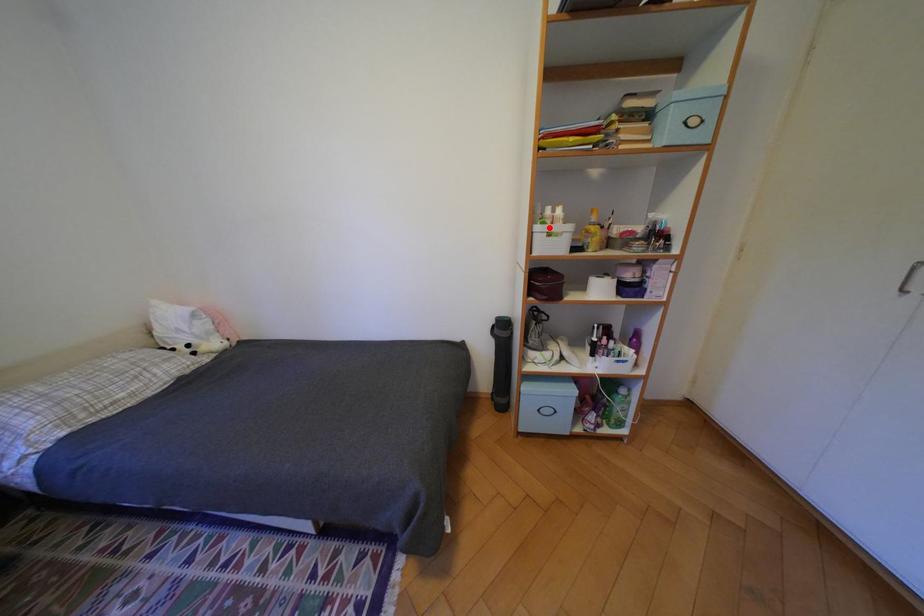
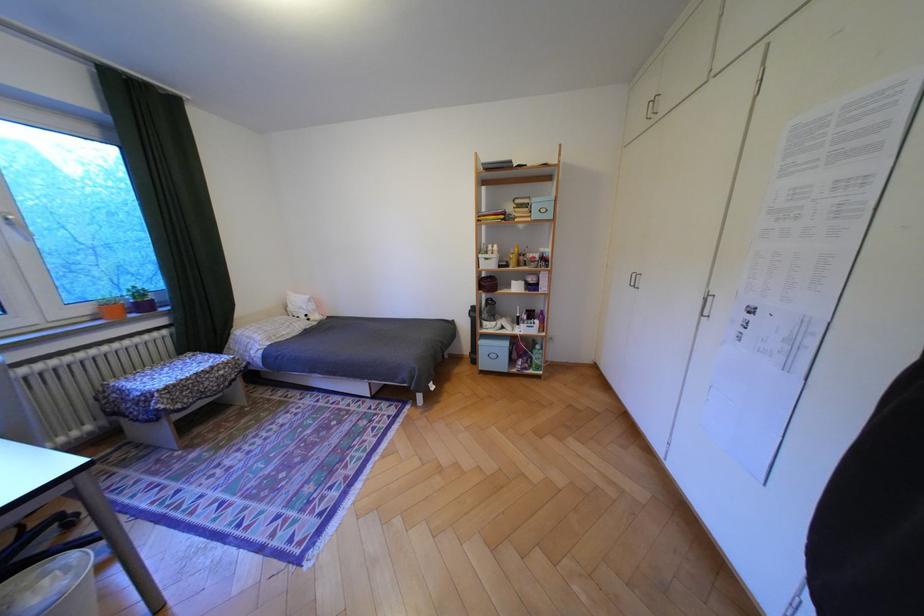
The point at the highlighted location is marked in the first image. Where is the corresponding point in the second image?

(492, 256)